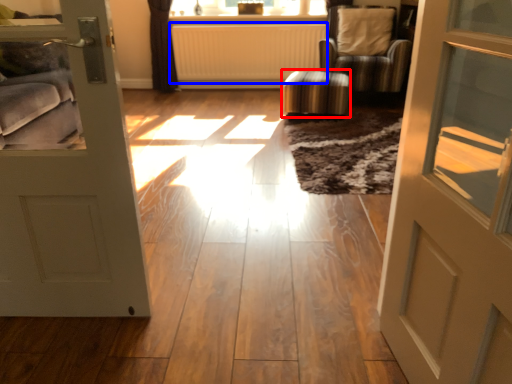
Question: Among these objects, which one is farthest to the camera, stool (highlighted by a red box) or radiator (highlighted by a blue box)?

Choices:
 (A) stool
 (B) radiator

Answer: (B)